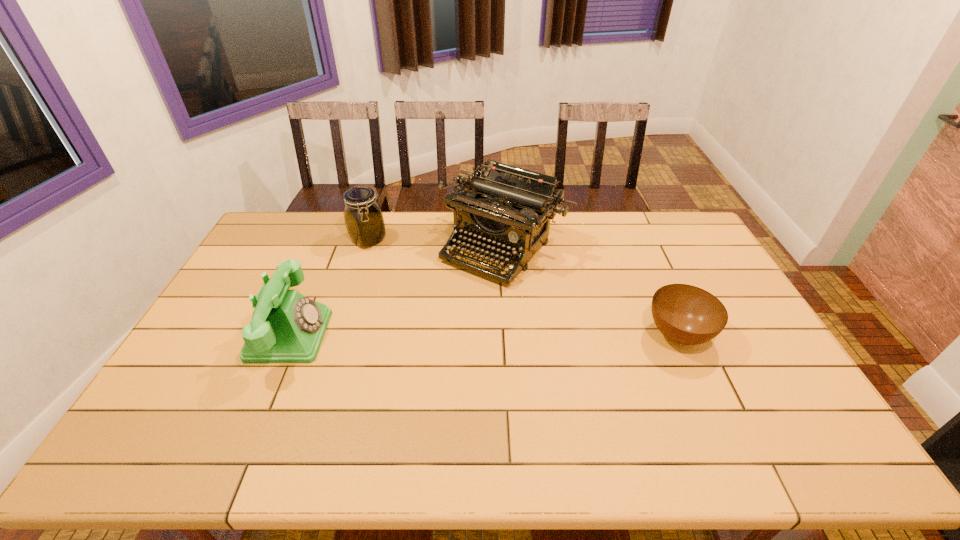
Where is `telephone`? telephone is located at coordinates (286, 327).

This screenshot has width=960, height=540. What are the coordinates of `bowl` in the screenshot? It's located at (686, 314).

Identify the location of the rightmost object. (686, 314).

Where is `jar`? jar is located at coordinates (364, 221).

At what (x,y) coordinates should I click in order to perform the action: click on typewriter. Please return your answer as a coordinate pair (x, y). Image resolution: width=960 pixels, height=540 pixels. Looking at the image, I should click on (509, 210).

Find the location of `the tallest object`. the tallest object is located at coordinates (509, 210).

This screenshot has width=960, height=540. What are the coordinates of `blank space located on the dial of the telephone` in the screenshot? It's located at (353, 335).

The width and height of the screenshot is (960, 540). I want to click on free space located 0.150m on the front of the bowl, so click(711, 409).

I want to click on vacant space positioned 0.370m on the lid of the jar, so click(446, 298).

Locate an element on the screen. This screenshot has width=960, height=540. free space located 0.200m on the lid of the jar is located at coordinates (414, 273).